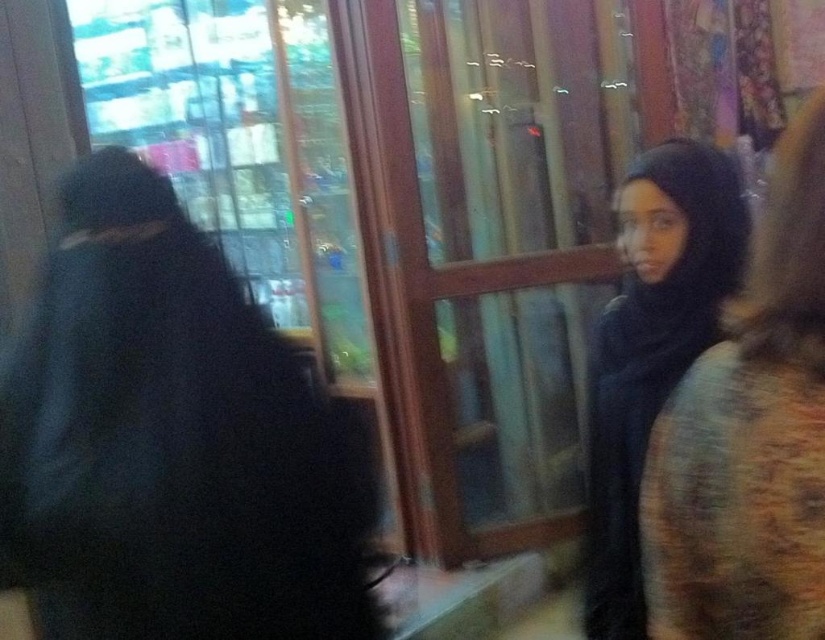
Does point (418, 269) come farther from viewer compared to point (630, 618)?

Yes.

You are a GUI agent. You are given a task and a screenshot of the screen. Output one action in this format:
    pyautogui.click(x=<x>, y=<y>)
    Task: Click on the transparent glass door at center
    
    Given the screenshot: What is the action you would take?
    pyautogui.click(x=493, y=252)

Is black matte coat at left wider than transparent glass door at center?

In fact, black matte coat at left might be narrower than transparent glass door at center.

Does point (375, 627) come closer to viewer compared to point (425, 225)?

That is True.

This screenshot has width=825, height=640. In order to click on black matte coat at left in this screenshot , I will do `click(168, 440)`.

You are a GUI agent. You are given a task and a screenshot of the screen. Output one action in this format:
    pyautogui.click(x=<x>, y=<y>)
    Task: Click on the black matte coat at left
    
    Given the screenshot: What is the action you would take?
    pyautogui.click(x=168, y=440)

Is point (526, 36) closer to camera compared to point (752, 451)?

No, (526, 36) is further to viewer.

The image size is (825, 640). In order to click on transparent glass door at center in this screenshot , I will do `click(493, 252)`.

Is point (359, 1) positioned behind point (805, 275)?

Yes, it is behind point (805, 275).

The image size is (825, 640). I want to click on transparent glass door at center, so click(x=493, y=252).